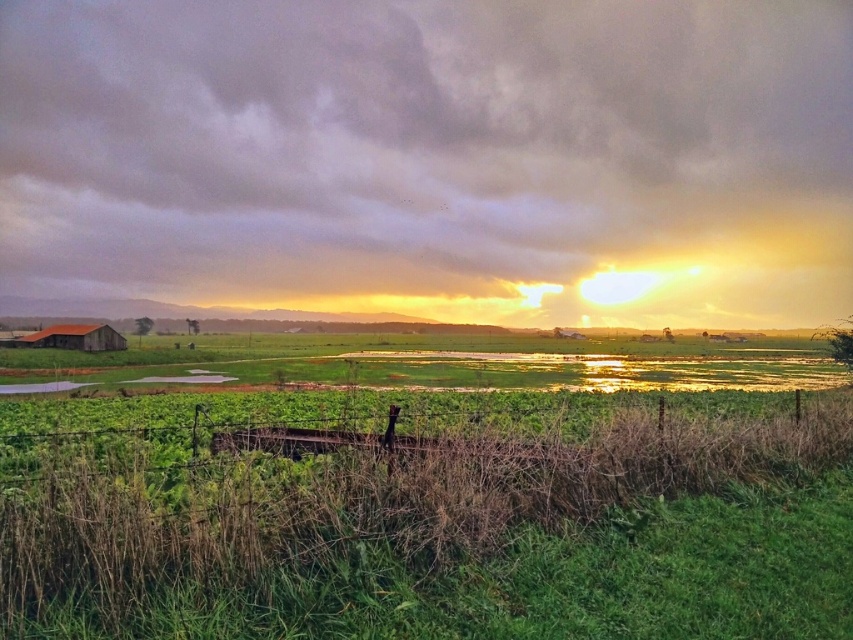
Looking at this image, you are a photographer wanting to capture the cloudy sky at upper center and the green grassy field at lower center in a single shot. Based on the scene, can you determine which object is located above the other?

The cloudy sky at upper center is positioned over the green grassy field at lower center, so the cloudy sky at upper center is above the green grassy field at lower center.

You are a farmer checking the field. You notice the green grassy field at lower center and the rustic wooden barn at lower left. Which one is shorter?

The green grassy field at lower center is shorter than the rustic wooden barn at lower left.